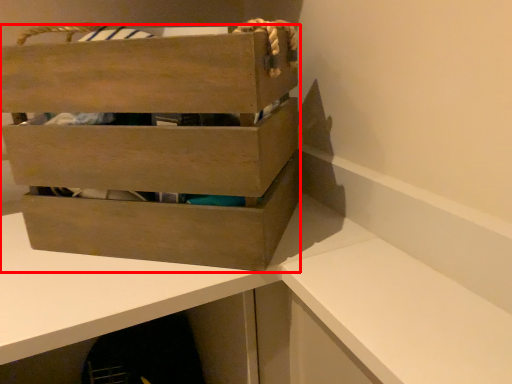
Question: Considering the relative positions of box (annotated by the red box) and table in the image provided, where is box (annotated by the red box) located with respect to the staircase?

Choices:
 (A) left
 (B) right

Answer: (B)